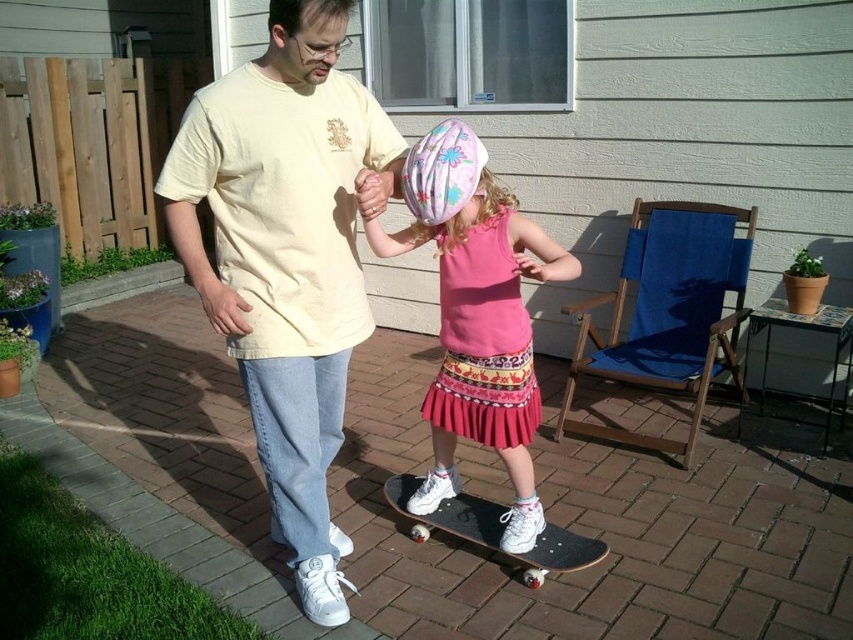
Can you confirm if matte yellow t-shirt at center is positioned below black smooth skateboard at center?

No, matte yellow t-shirt at center is not below black smooth skateboard at center.

Does matte yellow t-shirt at center lie in front of black smooth skateboard at center?

Yes, it is in front of black smooth skateboard at center.

The image size is (853, 640). Identify the location of matte yellow t-shirt at center. (287, 257).

Is pink fabric skirt at center positioned before black smooth skateboard at center?

Yes.

Between pink fabric skirt at center and black smooth skateboard at center, which one has more height?

pink fabric skirt at center is taller.

The height and width of the screenshot is (640, 853). What do you see at coordinates (476, 314) in the screenshot?
I see `pink fabric skirt at center` at bounding box center [476, 314].

Locate an element on the screen. The image size is (853, 640). pink fabric skirt at center is located at coordinates (476, 314).

Who is shorter, matte yellow t-shirt at center or pink fabric skirt at center?

pink fabric skirt at center is shorter.

Is point (302, 451) closer to camera compared to point (466, 256)?

That is True.

Who is more distant from viewer, (305, 264) or (496, 440)?

The point (496, 440) is more distant.

Image resolution: width=853 pixels, height=640 pixels. In order to click on matte yellow t-shirt at center in this screenshot , I will do `click(287, 257)`.